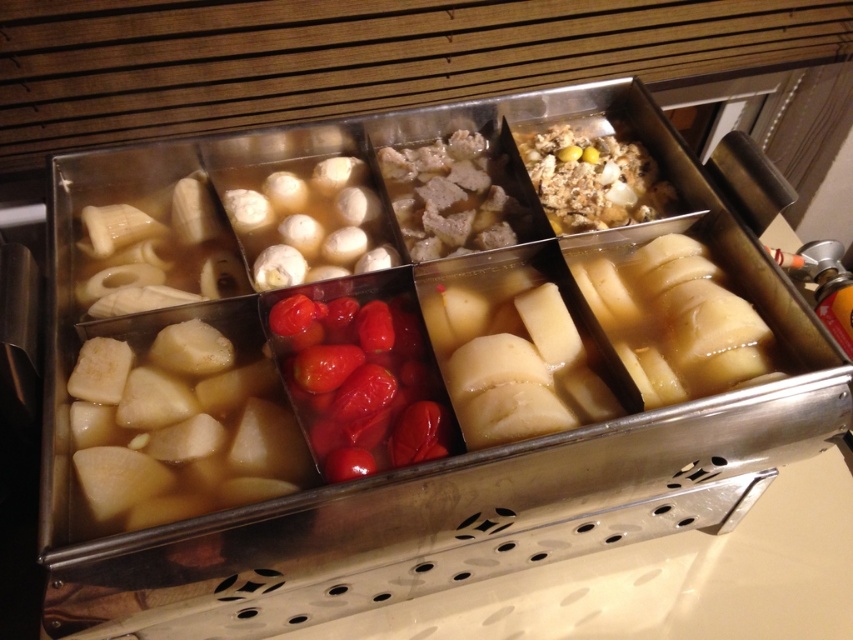
You are a chef preparing a dish and need to place the white matte potato at center and brown meat at center onto a plate. Based on their positions in the image, which one should you pick up first to maintain the arrangement?

The white matte potato at center should be picked up first because it is positioned under the brown meat at center, meaning it is lower and closer to the plate.

You are a food inspector checking the buffet layout. You see a point marked at coordinates (514, 360). Which food item is this point located on?

The point at coordinates (514, 360) is located on the white matte potato at center.

You are standing in front of the food preparation setup and want to locate the brown meat at center. Can you tell me its exact 2D coordinates?

The brown meat at center is located at the 2D coordinates of point (450, 195).